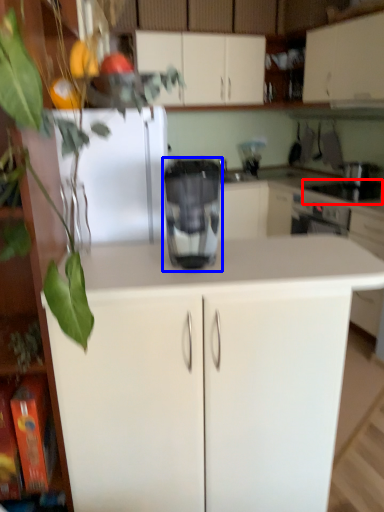
Question: Which of the following is the farthest to the observer, appliance (highlighted by a red box) or home appliance (highlighted by a blue box)?

Choices:
 (A) appliance
 (B) home appliance

Answer: (A)